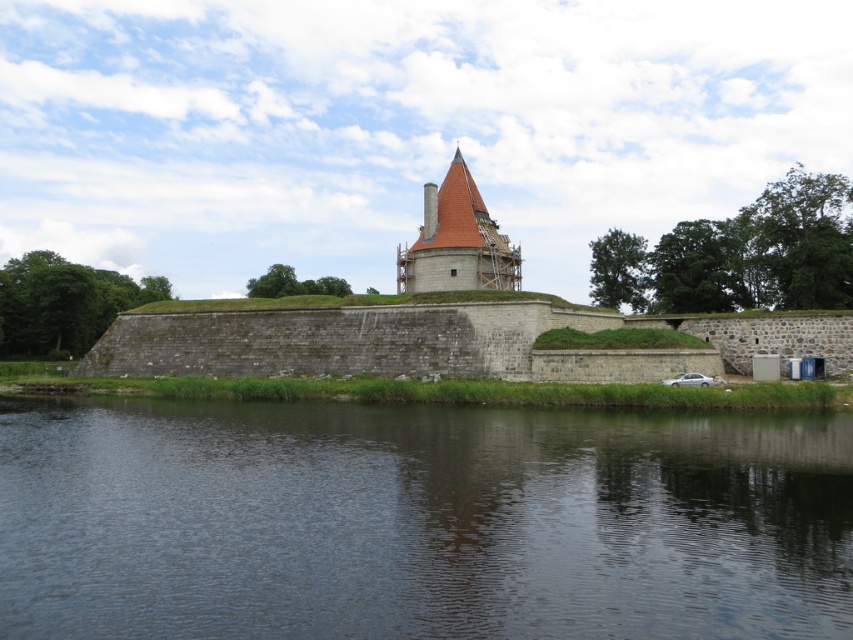
You are standing at the base of the historic stone structure and want to walk towards the point marked as point [463,225]. However, there is an obstacle at point [416,593]. Will you encounter the obstacle before reaching your destination?

Yes, you will encounter the obstacle at point [416,593] before reaching your destination at point [463,225] because point [416,593] is in front of point [463,225].

You are standing on the grassy mound near the dark water at lower center and want to reach the brown tiled tower at center. Which direction should you move to get closer to the tower?

You should move away from the dark water at lower center towards the brown tiled tower at center since the water is closer to you than the tower.

You are a tourist standing at the edge of the moat looking towards the brown tiled tower at center. Can you see the top of the dark water at lower center from your current position, considering the height difference between them?

The dark water at lower center has a lesser height compared to the brown tiled tower at center. Since the tower is taller, you can see its top from your position, but the dark water at lower center is lower and might be obscured by the tower or other structures unless you move to a higher vantage point.